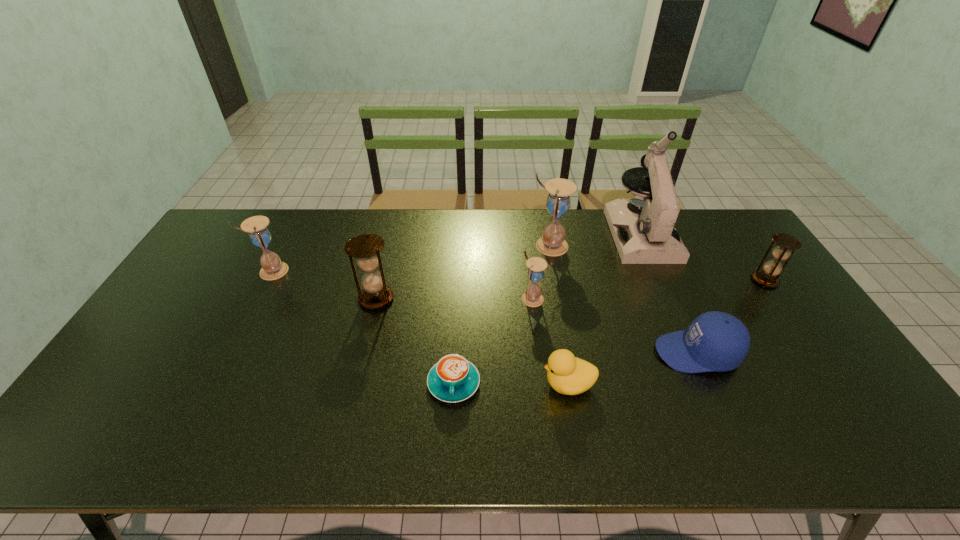
In the image, there is a desktop. At what (x,y) coordinates should I click in order to perform the action: click on vacant space at the far edge. Please return your answer as a coordinate pair (x, y). Looking at the image, I should click on (588, 231).

Where is `free point at the near edge`? The height and width of the screenshot is (540, 960). free point at the near edge is located at coordinates (583, 427).

This screenshot has height=540, width=960. What are the coordinates of `free region at the left edge of the desktop` in the screenshot? It's located at (153, 377).

At what (x,y) coordinates should I click in order to perform the action: click on blank space at the right edge of the desktop. Please return your answer as a coordinate pair (x, y). This screenshot has height=540, width=960. Looking at the image, I should click on (732, 284).

At what (x,y) coordinates should I click in order to perform the action: click on vacant area at the far left corner. Please return your answer as a coordinate pair (x, y). The image size is (960, 540). Looking at the image, I should click on (244, 218).

Identify the location of vacant space in between the duck and the seventh object from right to left. The height and width of the screenshot is (540, 960). (511, 383).

The image size is (960, 540). Find the location of `vacant region between the shortest object and the microscope`. vacant region between the shortest object and the microscope is located at coordinates (547, 309).

Locate an element on the screen. This screenshot has width=960, height=540. blank region between the biggest white hourglass and the leftmost hourglass is located at coordinates (411, 258).

Find the location of a particular element. The width and height of the screenshot is (960, 540). free spot between the bigger brown hourglass and the rightmost hourglass is located at coordinates (570, 289).

Find the location of `empty location between the right brown hourglass and the duck`. empty location between the right brown hourglass and the duck is located at coordinates coord(666,332).